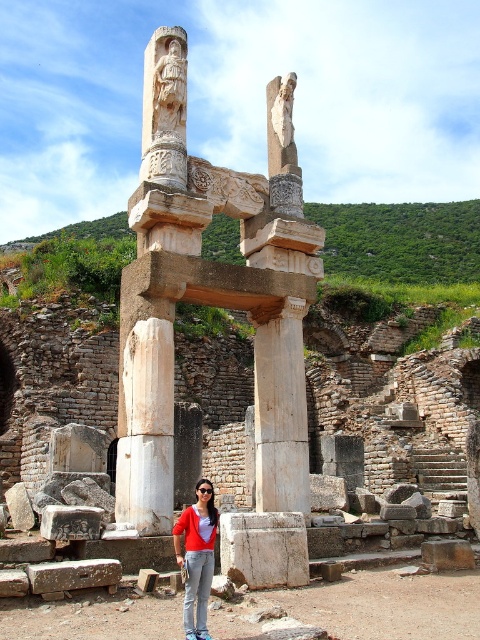
Question: Does white stone column at center have a lesser width compared to matte red sweater at center?

Choices:
 (A) yes
 (B) no

Answer: (B)

Question: Considering the relative positions of white stone column at center and matte red sweater at center in the image provided, where is white stone column at center located with respect to matte red sweater at center?

Choices:
 (A) left
 (B) right

Answer: (A)

Question: Which point is closer to the camera?

Choices:
 (A) matte red sweater at center
 (B) white stone column at center

Answer: (A)

Question: Which object appears closest to the camera in this image?

Choices:
 (A) matte red sweater at center
 (B) white stone column at center

Answer: (A)

Question: Is white stone column at center to the right of matte red sweater at center from the viewer's perspective?

Choices:
 (A) yes
 (B) no

Answer: (B)